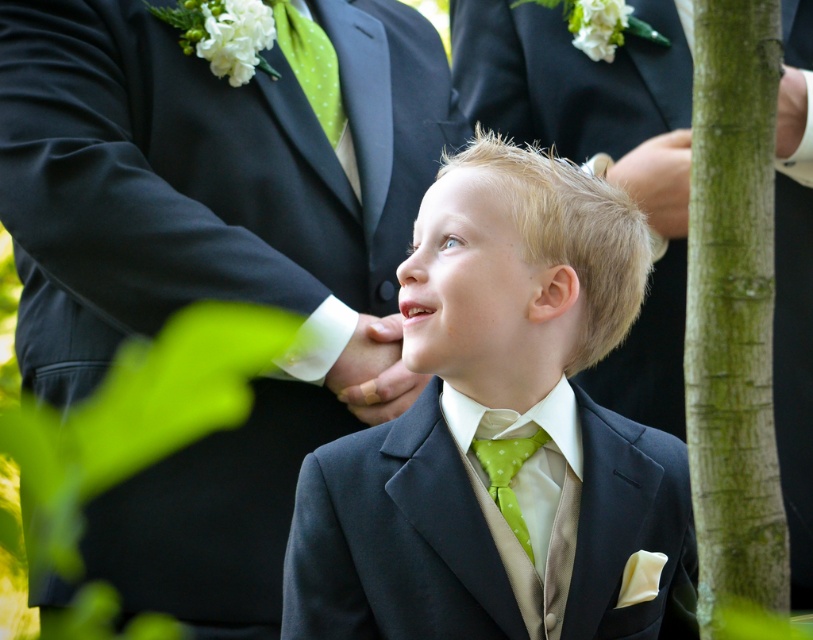
Question: Which point is farther from the camera taking this photo?

Choices:
 (A) (706, 417)
 (B) (412, 243)
 (C) (524, 524)

Answer: (B)

Question: Is green dotted fabric tie at center bigger than matte green nose at center?

Choices:
 (A) yes
 (B) no

Answer: (A)

Question: Does matte black suit at center lie behind green rough bark at right?

Choices:
 (A) yes
 (B) no

Answer: (A)

Question: Which point appears closest to the camera in this image?

Choices:
 (A) (574, 608)
 (B) (751, 92)
 (C) (424, 266)
 (D) (498, 454)

Answer: (B)

Question: Is matte black suit at center thinner than green rough bark at right?

Choices:
 (A) no
 (B) yes

Answer: (A)

Question: Which point is farther from the camera taking this photo?

Choices:
 (A) (746, 208)
 (B) (527, 396)
 (C) (522, 525)
 (D) (428, 257)

Answer: (B)